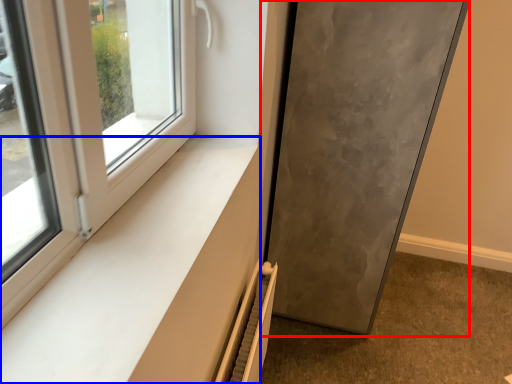
Question: Which point is further to the camera, door (highlighted by a red box) or window sill (highlighted by a blue box)?

Choices:
 (A) door
 (B) window sill

Answer: (A)